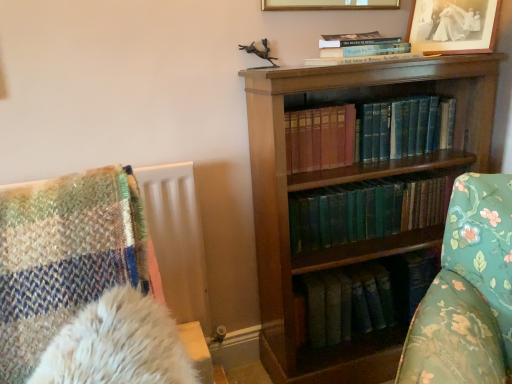
Question: Is hardcover book at upper center, which is the first book from top to bottom, shorter than black paper picture frame at upper right, which ranks as the first picture frame in right-to-left order?

Choices:
 (A) yes
 (B) no

Answer: (A)

Question: From the image's perspective, is hardcover book at upper center, which is the first book from top to bottom, on top of black paper picture frame at upper right, which is the 2th picture frame from left to right?

Choices:
 (A) no
 (B) yes

Answer: (A)

Question: Is hardcover book at upper center, which is the 3th book from bottom to top, with black paper picture frame at upper right, which is the 2th picture frame from left to right?

Choices:
 (A) no
 (B) yes

Answer: (A)

Question: From a real-world perspective, is hardcover book at upper center, which is the first book from top to bottom, below black paper picture frame at upper right, which ranks as the first picture frame in right-to-left order?

Choices:
 (A) yes
 (B) no

Answer: (A)

Question: Considering the relative sizes of hardcover book at upper center, which is the first book from top to bottom, and black paper picture frame at upper right, which ranks as the first picture frame in right-to-left order, in the image provided, is hardcover book at upper center, which is the first book from top to bottom, thinner than black paper picture frame at upper right, which ranks as the first picture frame in right-to-left order,?

Choices:
 (A) no
 (B) yes

Answer: (A)

Question: From the image's perspective, is green leather book at center, positioned as the third book in top-to-bottom order, positioned above or below blue leather book at center, the 2th book ordered from the bottom?

Choices:
 (A) above
 (B) below

Answer: (B)

Question: Is green leather book at center, the 1th book in the bottom-to-top sequence, spatially inside blue leather book at center, the 2th book ordered from the bottom, or outside of it?

Choices:
 (A) outside
 (B) inside

Answer: (A)

Question: Based on their positions, is green leather book at center, positioned as the third book in top-to-bottom order, located to the left or right of blue leather book at center, which is the 2th book from top to bottom?

Choices:
 (A) right
 (B) left

Answer: (B)

Question: Considering the positions of green leather book at center, the 1th book in the bottom-to-top sequence, and blue leather book at center, the 2th book ordered from the bottom, in the image, is green leather book at center, the 1th book in the bottom-to-top sequence, taller or shorter than blue leather book at center, the 2th book ordered from the bottom,?

Choices:
 (A) tall
 (B) short

Answer: (B)

Question: Considering the positions of wooden bookcase at center and gold/glossy picture frame at upper center, which appears as the first picture frame when viewed from the left, in the image, is wooden bookcase at center wider or thinner than gold/glossy picture frame at upper center, which appears as the first picture frame when viewed from the left,?

Choices:
 (A) thin
 (B) wide

Answer: (B)

Question: Is wooden bookcase at center to the left or to the right of gold/glossy picture frame at upper center, the 2th picture frame when ordered from right to left, in the image?

Choices:
 (A) left
 (B) right

Answer: (B)

Question: Considering the positions of wooden bookcase at center and gold/glossy picture frame at upper center, which appears as the first picture frame when viewed from the left, in the image, is wooden bookcase at center bigger or smaller than gold/glossy picture frame at upper center, which appears as the first picture frame when viewed from the left,?

Choices:
 (A) big
 (B) small

Answer: (A)

Question: From their relative heights in the image, would you say wooden bookcase at center is taller or shorter than gold/glossy picture frame at upper center, the 2th picture frame when ordered from right to left?

Choices:
 (A) tall
 (B) short

Answer: (A)

Question: Considering the positions of black paper picture frame at upper right, which is the 2th picture frame from left to right, and green leather book at center, positioned as the third book in top-to-bottom order, in the image, is black paper picture frame at upper right, which is the 2th picture frame from left to right, wider or thinner than green leather book at center, positioned as the third book in top-to-bottom order,?

Choices:
 (A) thin
 (B) wide

Answer: (A)

Question: Choose the correct answer: Is black paper picture frame at upper right, which is the 2th picture frame from left to right, inside green leather book at center, positioned as the third book in top-to-bottom order, or outside it?

Choices:
 (A) inside
 (B) outside

Answer: (B)